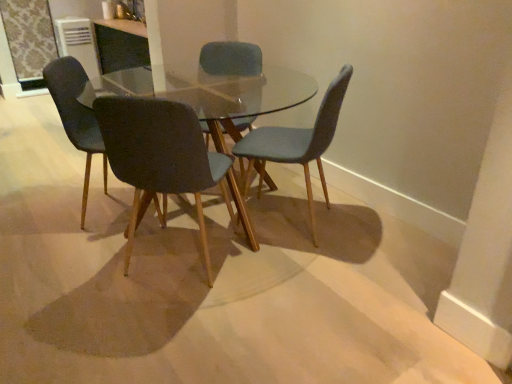
Find the location of a particular element. free space in front of matte black chair at center, which is the 2th chair in left-to-right order is located at coordinates (165, 325).